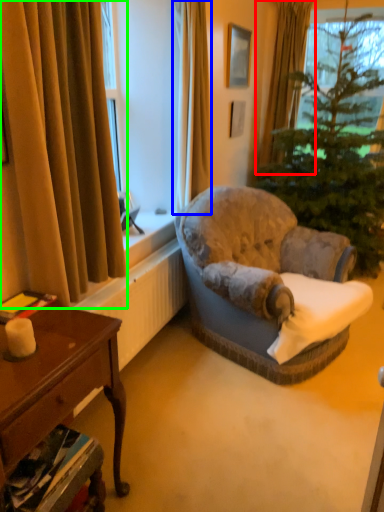
Question: Which object is positioned farthest from curtain (highlighted by a red box)? Select from curtain (highlighted by a blue box) and curtain (highlighted by a green box).

Choices:
 (A) curtain
 (B) curtain

Answer: (B)